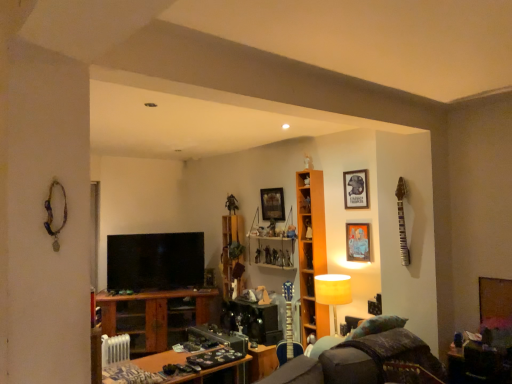
Question: Is metallic figure at upper center facing towards wooden cabinet at center, which appears as the first cabinet when viewed from the front?

Choices:
 (A) no
 (B) yes

Answer: (A)

Question: Is metallic figure at upper center in contact with wooden cabinet at center, placed as the 1th cabinet when sorted from right to left?

Choices:
 (A) yes
 (B) no

Answer: (B)

Question: Considering the relative sizes of metallic figure at upper center and wooden cabinet at center, which appears as the first cabinet when viewed from the front, in the image provided, is metallic figure at upper center shorter than wooden cabinet at center, which appears as the first cabinet when viewed from the front,?

Choices:
 (A) no
 (B) yes

Answer: (A)

Question: Considering the relative sizes of metallic figure at upper center and wooden cabinet at center, placed as the 1th cabinet when sorted from right to left, in the image provided, is metallic figure at upper center taller than wooden cabinet at center, placed as the 1th cabinet when sorted from right to left,?

Choices:
 (A) no
 (B) yes

Answer: (B)

Question: From the image's perspective, is metallic figure at upper center beneath wooden cabinet at center, arranged as the third cabinet when viewed from the left?

Choices:
 (A) yes
 (B) no

Answer: (B)

Question: Does metallic figure at upper center appear on the left side of wooden cabinet at center, arranged as the third cabinet when viewed from the left?

Choices:
 (A) yes
 (B) no

Answer: (A)

Question: Is matte black picture frame at upper right, the second picture frame viewed from the back, outside orange wood shelf at center?

Choices:
 (A) yes
 (B) no

Answer: (A)

Question: From the image's perspective, would you say matte black picture frame at upper right, the second picture frame viewed from the back, is positioned over orange wood shelf at center?

Choices:
 (A) no
 (B) yes

Answer: (B)

Question: Is matte black picture frame at upper right, the second picture frame viewed from the front, far away from orange wood shelf at center?

Choices:
 (A) yes
 (B) no

Answer: (B)

Question: Is matte black picture frame at upper right, the second picture frame viewed from the front, further to the viewer compared to orange wood shelf at center?

Choices:
 (A) yes
 (B) no

Answer: (B)

Question: Is matte black picture frame at upper right, the second picture frame viewed from the front, smaller than orange wood shelf at center?

Choices:
 (A) yes
 (B) no

Answer: (A)

Question: Is orange wood shelf at center completely or partially inside matte black picture frame at upper right, the second picture frame viewed from the front?

Choices:
 (A) yes
 (B) no

Answer: (B)

Question: From the image's perspective, does matte black picture frame at upper right, which is the third picture frame from left to right, appear lower than velvet dark brown swivel chair at lower right?

Choices:
 (A) no
 (B) yes

Answer: (A)